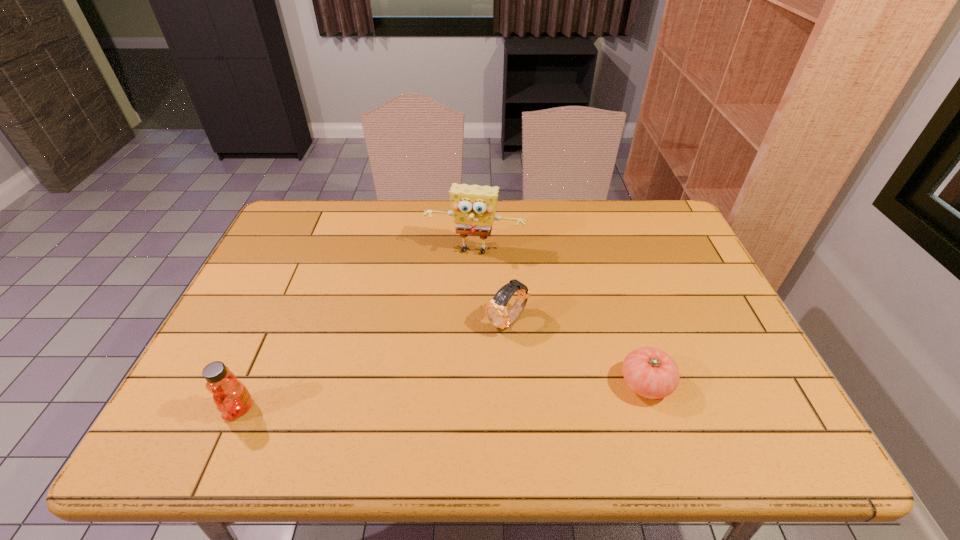
Identify the location of unoccupied area between the third nearest object and the sponge. (491, 287).

Locate an element on the screen. This screenshot has width=960, height=540. free space between the third shortest object and the sponge is located at coordinates (357, 330).

Identify the location of vacant region between the honey and the rightmost object. (443, 396).

Find the location of a particular element. The height and width of the screenshot is (540, 960). free space between the honey and the tallest object is located at coordinates (357, 330).

Find the location of a particular element. This screenshot has width=960, height=540. free spot between the tallest object and the leftmost object is located at coordinates (357, 330).

I want to click on object that stands as the closest to the shortest object, so click(x=496, y=310).

What are the coordinates of `object that is the closest to the third nearest object` in the screenshot? It's located at (473, 206).

Image resolution: width=960 pixels, height=540 pixels. I want to click on vacant region that satisfies the following two spatial constraints: 1. on the front side of the watch; 2. on the left side of the tomato, so click(511, 383).

You are a GUI agent. You are given a task and a screenshot of the screen. Output one action in this format:
    pyautogui.click(x=<x>, y=<y>)
    Task: Click on the vacant space that satisfies the following two spatial constraints: 1. on the front side of the tallest object; 2. on the left side of the third nearest object
    The image size is (960, 540).
    Given the screenshot: What is the action you would take?
    pyautogui.click(x=474, y=321)